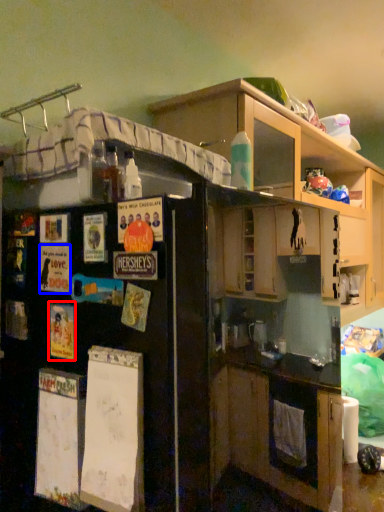
Question: Which of the following is the closest to the observer, poster (highlighted by a red box) or poster (highlighted by a blue box)?

Choices:
 (A) poster
 (B) poster

Answer: (A)